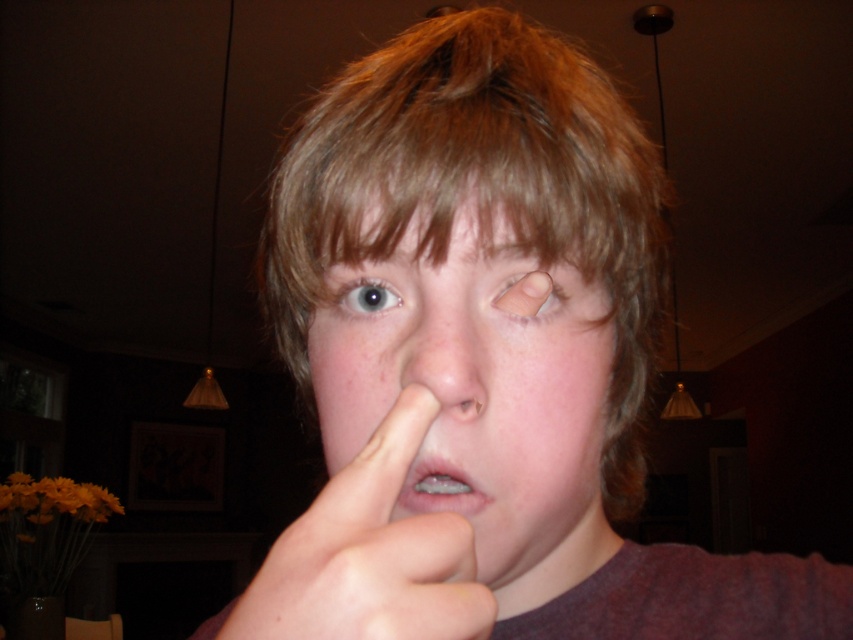
In the scene shown: You are a makeup artist preparing for a photoshoot. You need to apply eyeliner to the brown matte eyebrow at upper center without covering the clear plastic braces at center. Is this possible based on their positions?

The brown matte eyebrow at upper center is positioned over the clear plastic braces at center, so applying eyeliner to the brown matte eyebrow at upper center would not cover the clear plastic braces at center since it is located above it.

Based on the photo, you are a photographer adjusting the lighting for a portrait. You notice the light brown hair at center and the matte skin at center in the frame. Which object is covering part of the other?

The light brown hair at center is positioned over matte skin at center, so it is covering part of the matte skin at center.